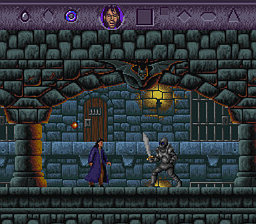
I want to click on lock, so click(226, 122), click(0, 119), click(86, 123).